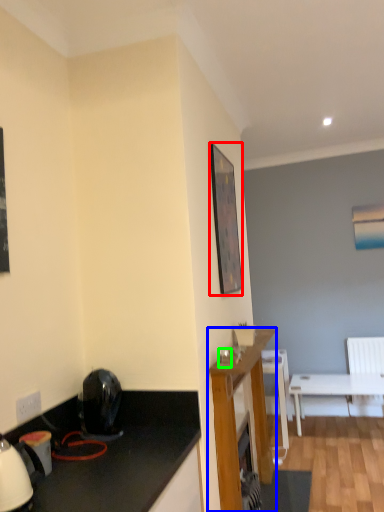
Question: Estimate the real-world distances between objects in this image. Which object is farther from picture frame (highlighted by a red box), cabinetry (highlighted by a blue box) or coffee cup (highlighted by a green box)?

Choices:
 (A) cabinetry
 (B) coffee cup

Answer: (A)